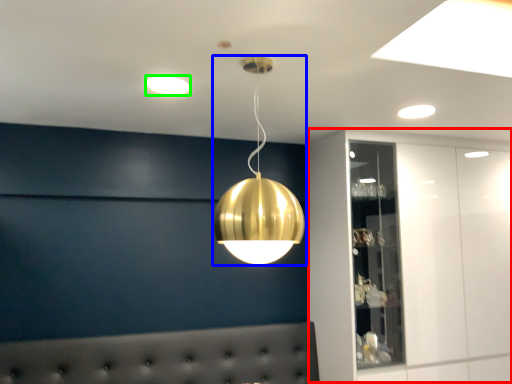
Question: Estimate the real-world distances between objects in this image. Which object is closer to dresser (highlighted by a red box), lamp (highlighted by a blue box) or lamp (highlighted by a green box)?

Choices:
 (A) lamp
 (B) lamp

Answer: (A)